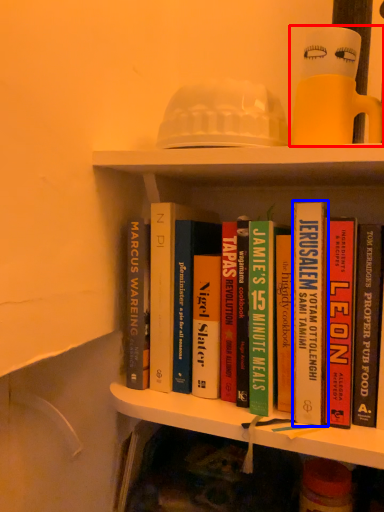
Question: Which point is further to the camera, toy (highlighted by a red box) or book (highlighted by a blue box)?

Choices:
 (A) toy
 (B) book

Answer: (B)